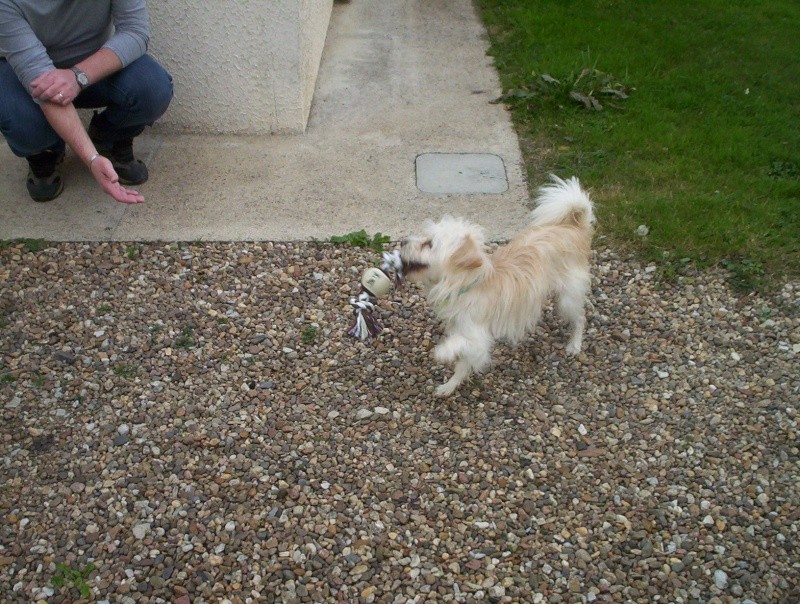
This screenshot has height=604, width=800. I want to click on toy, so click(385, 287).